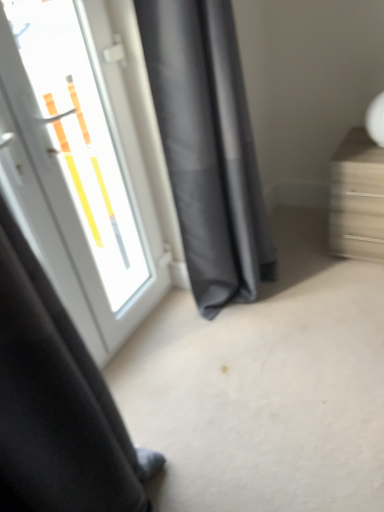
Find the location of a particular element. Image resolution: width=384 pixels, height=512 pixels. vacant area in front of white glossy door at upper left is located at coordinates [176, 371].